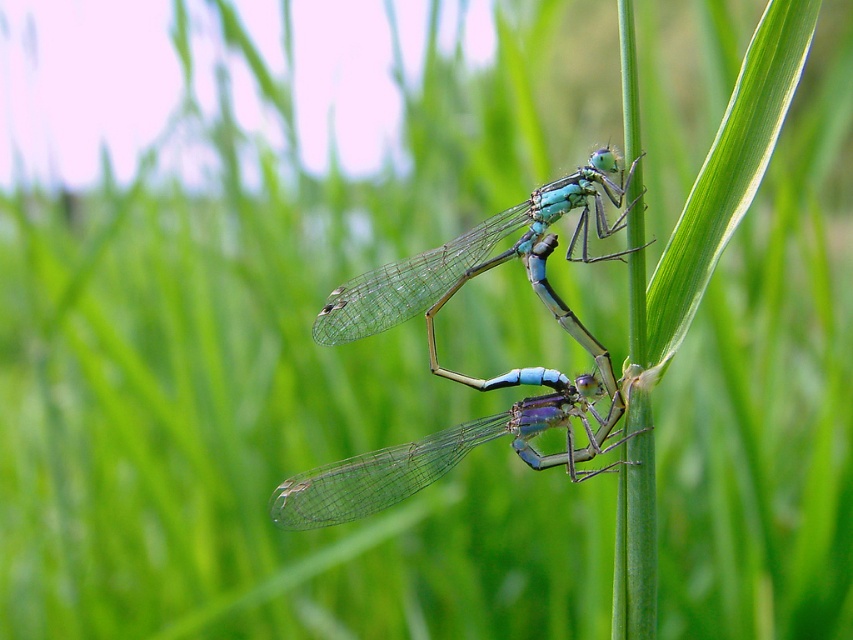
What do you see at coordinates (453, 452) in the screenshot? The height and width of the screenshot is (640, 853). I see `translucent blue dragonfly at center` at bounding box center [453, 452].

Does point (622, 392) come farther from viewer compared to point (593, 172)?

No, it is in front of (593, 172).

Is point (430, 435) closer to camera compared to point (457, 275)?

That is False.

At what (x,y) coordinates should I click in order to perform the action: click on translucent blue dragonfly at center. Please return your answer as a coordinate pair (x, y). The height and width of the screenshot is (640, 853). Looking at the image, I should click on (453, 452).